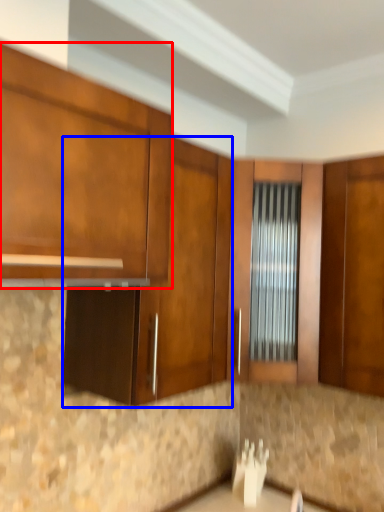
Question: Which of the following is the farthest to the observer, cabinetry (highlighted by a red box) or cabinetry (highlighted by a blue box)?

Choices:
 (A) cabinetry
 (B) cabinetry

Answer: (B)